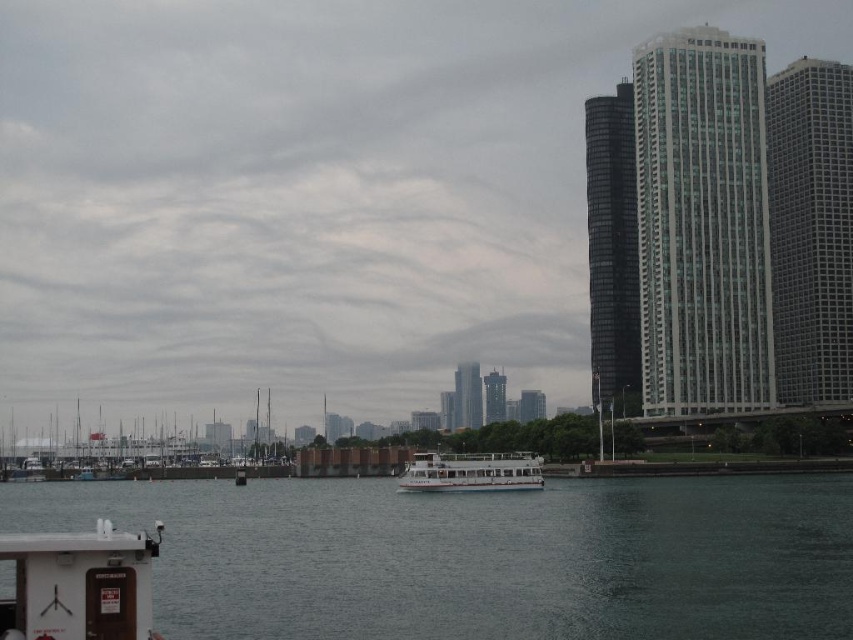
Question: Which of the following is the closest to the observer?

Choices:
 (A) (659, 616)
 (B) (500, 484)

Answer: (A)

Question: From the image, what is the correct spatial relationship of dark gray water at center in relation to white matte boat at center?

Choices:
 (A) above
 (B) below

Answer: (A)

Question: Which of the following is the farthest from the observer?

Choices:
 (A) white matte boat at center
 (B) dark gray water at center

Answer: (A)

Question: Does dark gray water at center lie behind white matte boat at center?

Choices:
 (A) no
 (B) yes

Answer: (A)

Question: Which object appears farthest from the camera in this image?

Choices:
 (A) dark gray water at center
 (B) white matte boat at center

Answer: (B)

Question: Can you confirm if dark gray water at center is thinner than white matte boat at center?

Choices:
 (A) yes
 (B) no

Answer: (B)